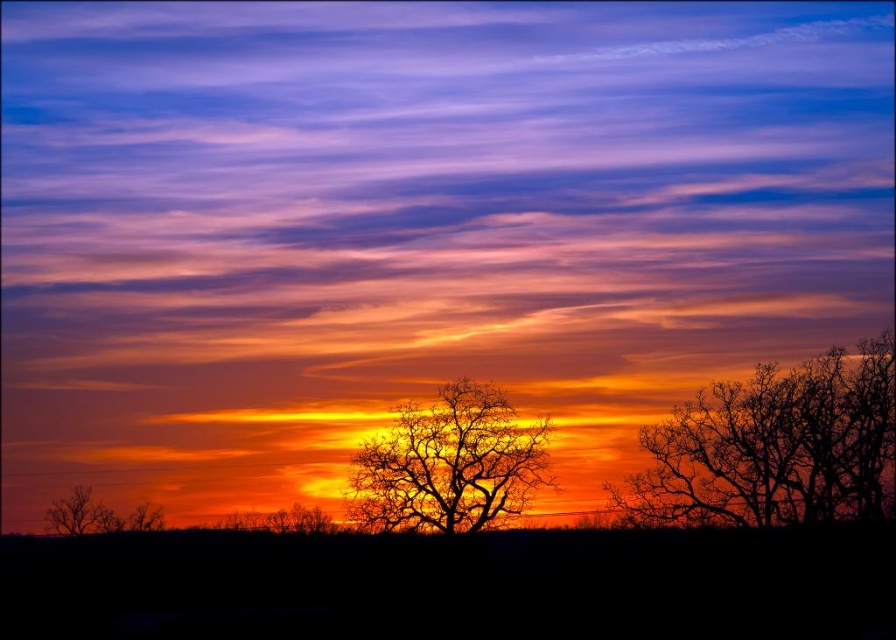
Between silhouette bare tree at right and brown matte tree at lower left, which one has more height?

With more height is silhouette bare tree at right.

Between point (874, 513) and point (90, 499), which one is positioned in front?

Point (874, 513) is in front.

In order to click on silhouette bare tree at right in this screenshot , I will do `click(773, 445)`.

What do you see at coordinates (773, 445) in the screenshot? I see `silhouette bare tree at right` at bounding box center [773, 445].

From the picture: Between silhouette bare tree at right and silhouette bare tree at center, which one has more height?

Standing taller between the two is silhouette bare tree at right.

Does point (867, 460) lie in front of point (398, 460)?

Yes, point (867, 460) is closer to viewer.

Locate an element on the screen. The height and width of the screenshot is (640, 896). silhouette bare tree at right is located at coordinates (773, 445).

Is silhouette bare tree at center wider than brown matte tree at lower left?

Indeed, silhouette bare tree at center has a greater width compared to brown matte tree at lower left.

Which is behind, point (470, 508) or point (85, 531)?

Point (85, 531)

Locate an element on the screen. The image size is (896, 640). silhouette bare tree at center is located at coordinates (448, 465).